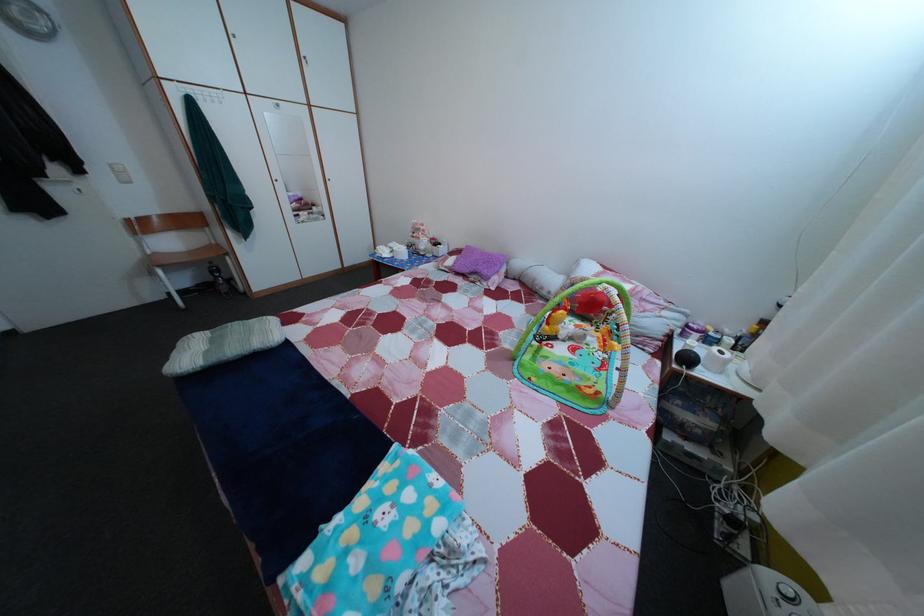
The width and height of the screenshot is (924, 616). I want to click on yellow hanging toy, so click(578, 346).